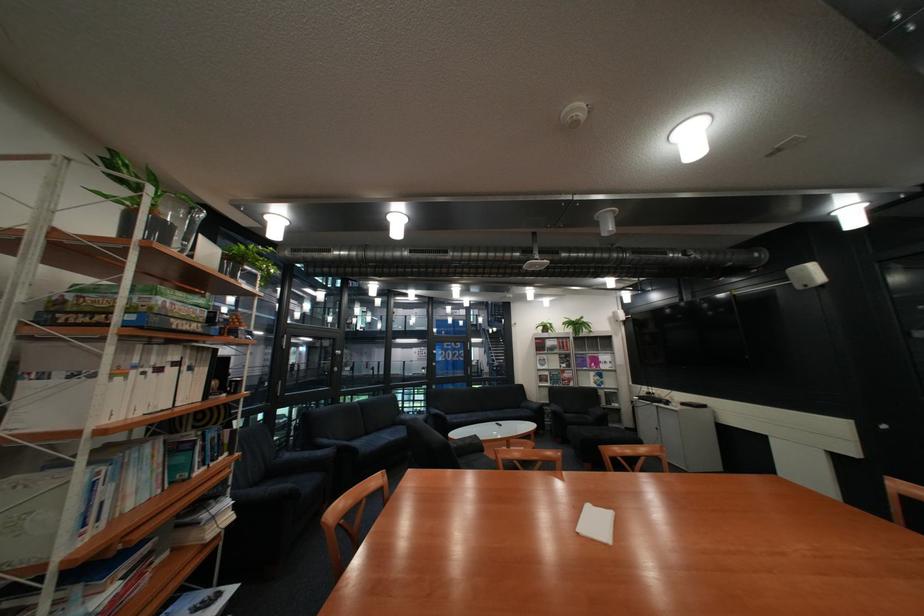
Where would you resting arm the dark chair armrest? Please return your answer as a coordinate pair (x, y).

(281, 496)